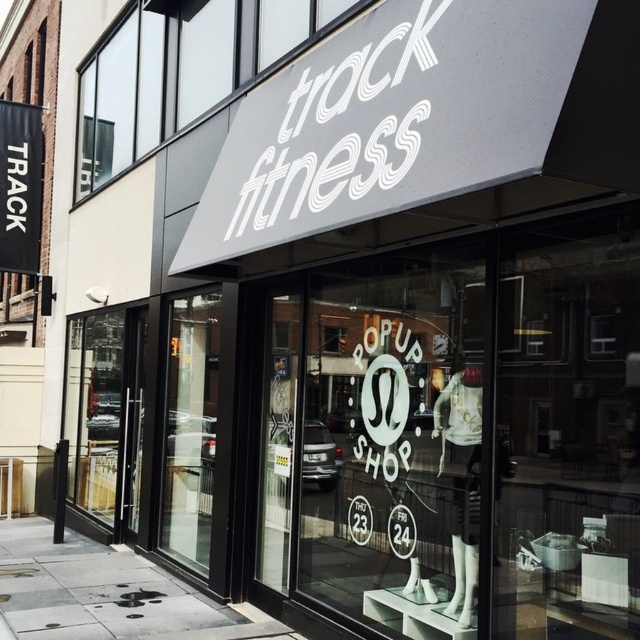
Question: Which point is closer to the camera taking this photo?

Choices:
 (A) (248, 624)
 (B) (166, 442)
 (C) (481, 548)

Answer: (C)

Question: Among these points, which one is farthest from the camera?

Choices:
 (A) (0, 572)
 (B) (93, 83)
 (C) (285, 102)
 (D) (435, 481)

Answer: (B)

Question: Which object is farther from the camera taking this photo?

Choices:
 (A) transparent glass door at center
 (B) transparent glass pop-up shop at center
 (C) white matte signboard at upper center
 (D) white matte sign at upper center

Answer: (A)

Question: Can you confirm if white matte signboard at upper center is wider than transparent glass door at center?

Choices:
 (A) yes
 (B) no

Answer: (A)

Question: Is transparent glass pop-up shop at center closer to camera compared to white matte signboard at upper center?

Choices:
 (A) yes
 (B) no

Answer: (A)

Question: Is white matte sign at upper center above gray concrete sidewalk at lower center?

Choices:
 (A) no
 (B) yes

Answer: (B)